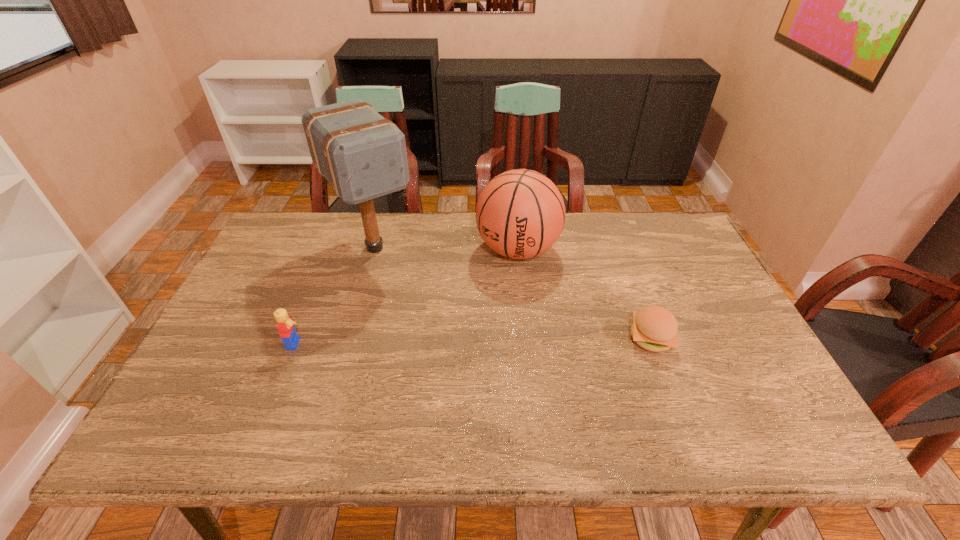
This screenshot has width=960, height=540. I want to click on Lego, so click(x=286, y=327).

Where is `the shortest object`? the shortest object is located at coordinates (654, 328).

Identify the location of the rightmost object. The height and width of the screenshot is (540, 960). (654, 328).

The width and height of the screenshot is (960, 540). Identify the location of the third shortest object. (520, 214).

What are the coordinates of `basketball` in the screenshot? It's located at (520, 214).

You are a GUI agent. You are given a task and a screenshot of the screen. Output one action in this format:
    pyautogui.click(x=<x>, y=<y>)
    Task: Click on the mallet
    This screenshot has width=960, height=540.
    Given the screenshot: What is the action you would take?
    pyautogui.click(x=363, y=156)

Find the location of `vacant area situated 0.070m on the face of the Lego`. vacant area situated 0.070m on the face of the Lego is located at coordinates (335, 343).

What are the coordinates of `vacant space located on the left of the shortest object` in the screenshot? It's located at (575, 338).

You are a GUI agent. You are given a task and a screenshot of the screen. Output one action in this format:
    pyautogui.click(x=<x>, y=<y>)
    Task: Click on the vacant region located 0.300m on the surface of the basketball near the brand logo
    This screenshot has height=540, width=960.
    Given the screenshot: What is the action you would take?
    pyautogui.click(x=463, y=350)

Where is `free spot located on the surface of the basketball near the brand logo`? free spot located on the surface of the basketball near the brand logo is located at coordinates (460, 357).